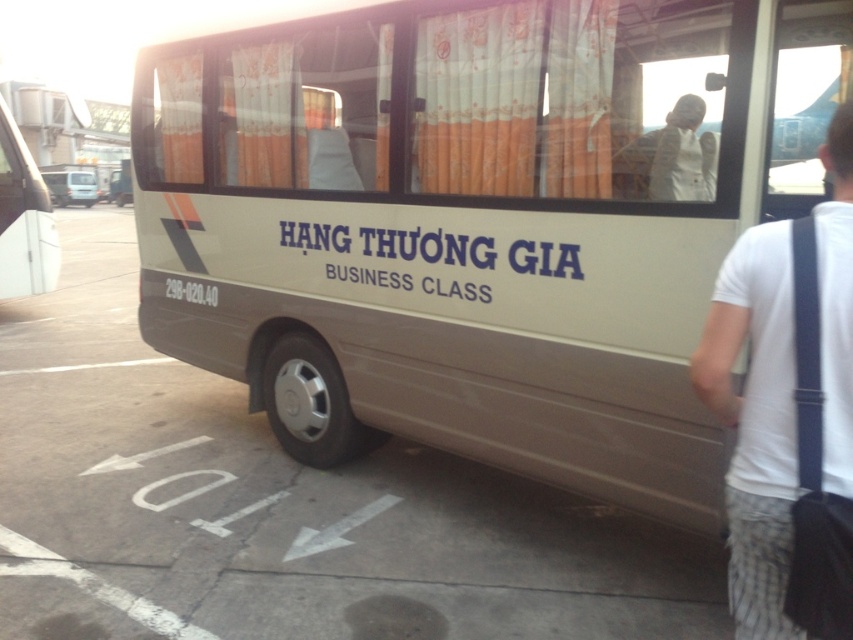
Describe the element at coordinates (788, 412) in the screenshot. I see `white cotton shirt at right` at that location.

In the scene shown: Is white cotton shirt at right closer to the viewer compared to beige matte bus at left?

That is True.

Does point (726, 481) come farther from viewer compared to point (68, 170)?

No, it is in front of (68, 170).

Where is `white cotton shirt at right`? This screenshot has width=853, height=640. white cotton shirt at right is located at coordinates (788, 412).

Does white cotton shirt at right have a smaller size compared to orange fabric curtain at upper center?

Correct, white cotton shirt at right occupies less space than orange fabric curtain at upper center.

Is white cotton shirt at right thinner than orange fabric curtain at upper center?

Correct, white cotton shirt at right's width is less than orange fabric curtain at upper center's.

Is point (833, 230) farther from viewer compared to point (158, 148)?

No, (833, 230) is in front of (158, 148).

Find the location of a particular element. This screenshot has height=640, width=853. white cotton shirt at right is located at coordinates (788, 412).

Which of these two, beige matte bus at center or orange fabric curtain at center, stands taller?

beige matte bus at center is taller.

Consider the image. Who is positioned more to the right, beige matte bus at center or orange fabric curtain at center?

beige matte bus at center

Describe the element at coordinates (486, 227) in the screenshot. I see `beige matte bus at center` at that location.

Image resolution: width=853 pixels, height=640 pixels. In order to click on beige matte bus at center in this screenshot , I will do `click(486, 227)`.